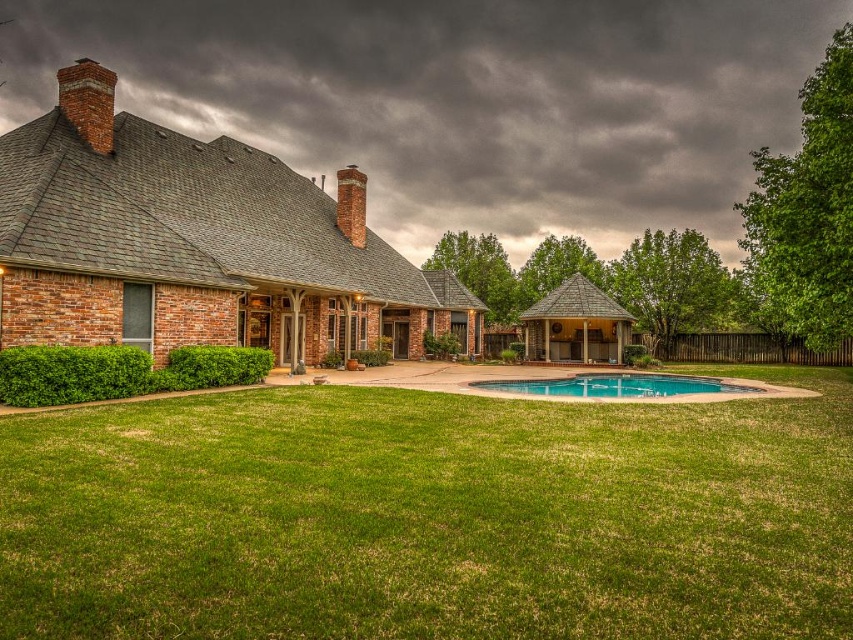
Question: Which point is farther to the camera?

Choices:
 (A) brick chimney at upper left
 (B) dark gray shingles at upper center
 (C) green grass at center

Answer: (B)

Question: Is green grass at center to the left of dark gray shingles at upper center from the viewer's perspective?

Choices:
 (A) yes
 (B) no

Answer: (B)

Question: Does dark gray shingles at upper center appear under clear blue water at center?

Choices:
 (A) no
 (B) yes

Answer: (A)

Question: Which object appears closest to the camera in this image?

Choices:
 (A) brick chimney at upper left
 (B) clear blue water at center
 (C) brick chimney at upper center
 (D) green grass at center

Answer: (D)

Question: Estimate the real-world distances between objects in this image. Which object is closer to the green grass at center?

Choices:
 (A) brick chimney at upper left
 (B) dark gray shingles at upper center
 (C) brick chimney at upper center

Answer: (A)

Question: Can you confirm if dark gray shingles at upper center is wider than clear blue water at center?

Choices:
 (A) yes
 (B) no

Answer: (A)